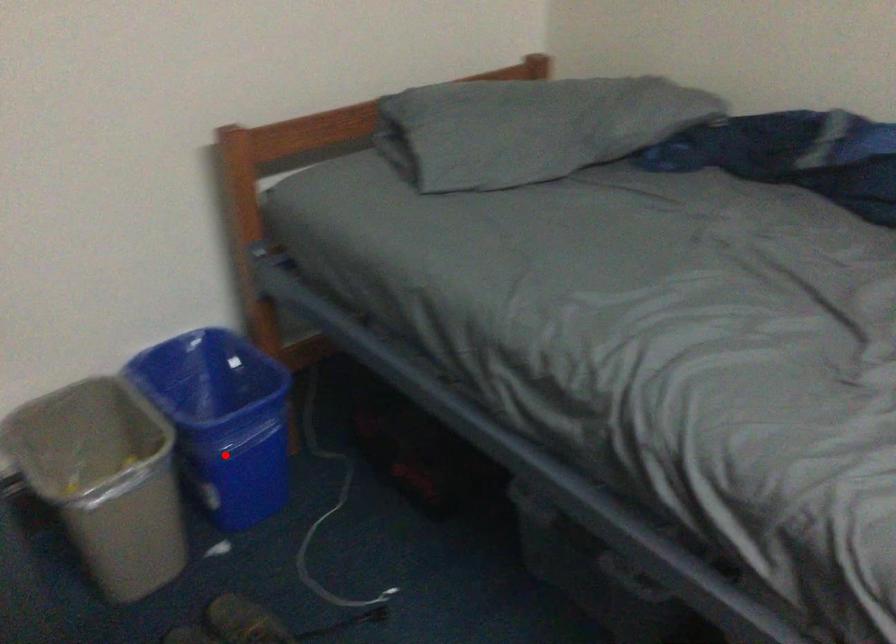
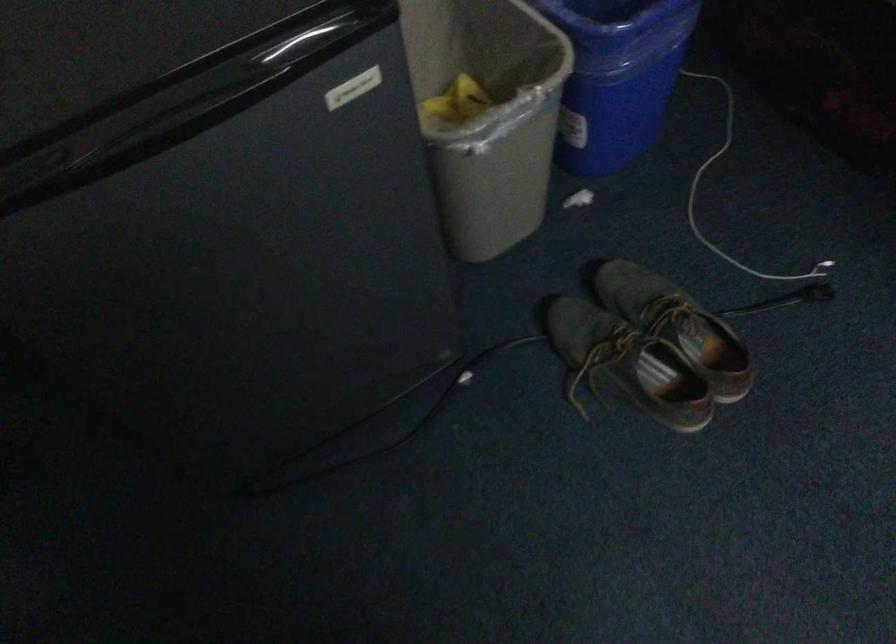
Find the pixel in the second image that matches the highlighted location in the first image.

(616, 76)